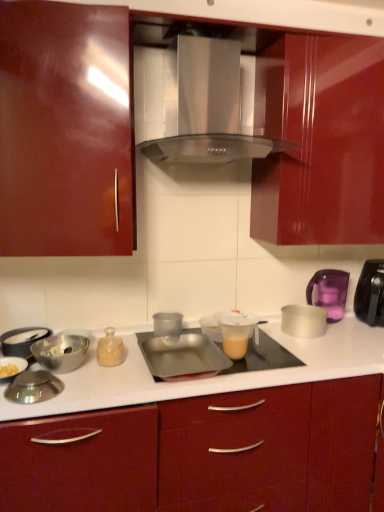
Identify the location of vacant area to the right of silver metallic bowl at left. This screenshot has height=512, width=384. (107, 379).